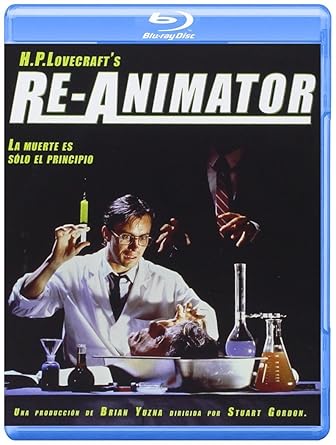
Locate an element on the screen. This screenshot has width=336, height=445. blu ray case is located at coordinates (237, 40).